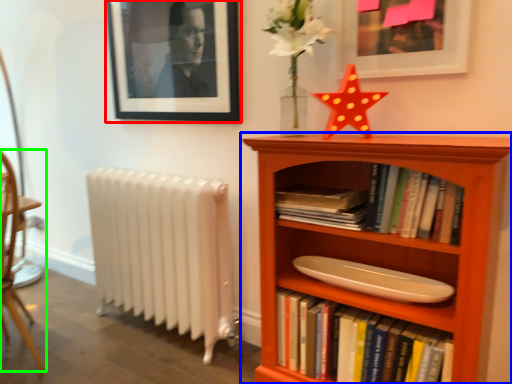
Question: Which object is the closest to the picture frame (highlighted by a red box)? Choose among these: bookcase (highlighted by a blue box) or chair (highlighted by a green box).

Choices:
 (A) bookcase
 (B) chair

Answer: (A)